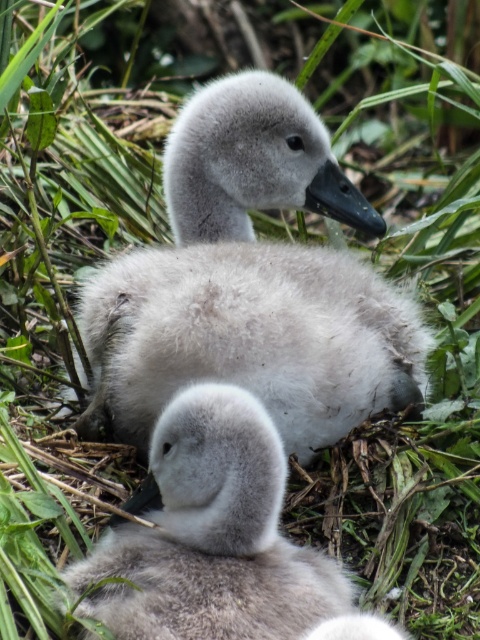
Question: Which of the following is the closest to the observer?

Choices:
 (A) (250, 504)
 (B) (208, 280)

Answer: (A)

Question: Which point is farther from the camera taking this photo?

Choices:
 (A) (130, 634)
 (B) (147, 355)

Answer: (B)

Question: Is fluffy gray swan at upper center to the left of soft gray down at center from the viewer's perspective?

Choices:
 (A) yes
 (B) no

Answer: (B)

Question: Can you confirm if fluffy gray swan at upper center is bigger than soft gray down at center?

Choices:
 (A) yes
 (B) no

Answer: (A)

Question: Is fluffy gray swan at upper center wider than soft gray down at center?

Choices:
 (A) yes
 (B) no

Answer: (A)